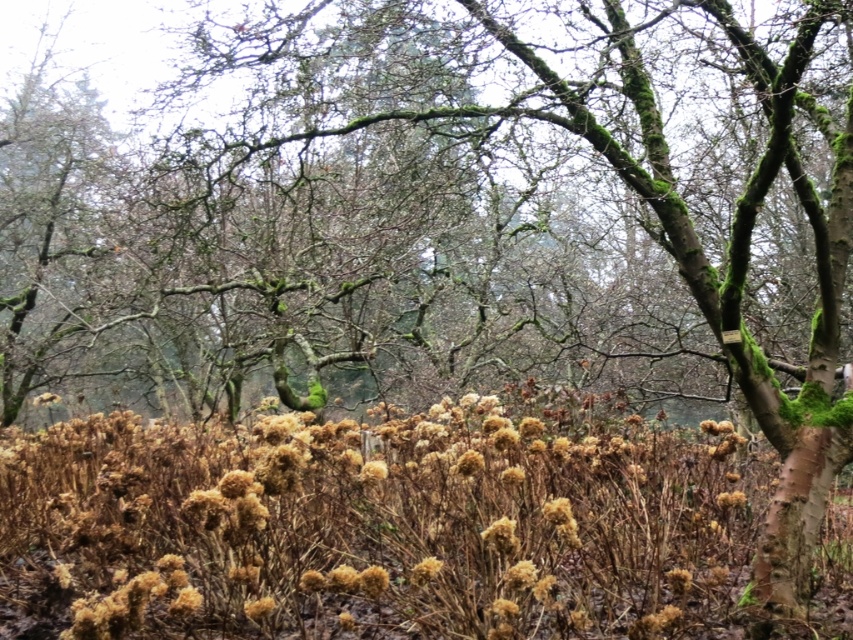
You are a hiker who wants to take a closer look at the brown fluffy flower at center without stepping on the brown fluffy plant at center. Which direction should you move to reach the flower?

The brown fluffy plant at center is positioned over the brown fluffy flower at center, so you should move downward or backward to avoid stepping on the plant and reach the flower.